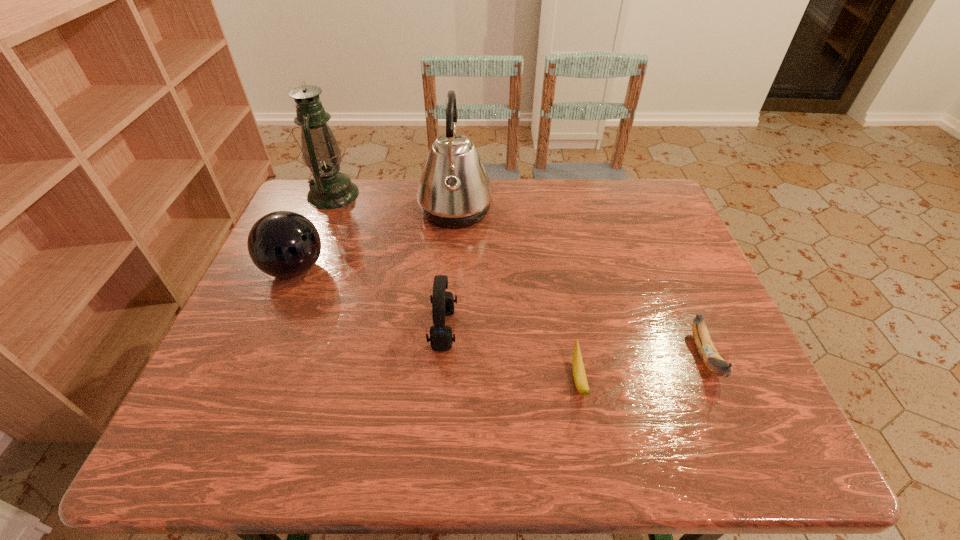
Where is `free spot between the right banana and the left banana`? free spot between the right banana and the left banana is located at coordinates (642, 368).

Where is `vacant region between the shorter banana and the fifth tallest object`? The height and width of the screenshot is (540, 960). vacant region between the shorter banana and the fifth tallest object is located at coordinates (642, 368).

Locate an element on the screen. The height and width of the screenshot is (540, 960). empty location between the bowling ball and the headset is located at coordinates (370, 299).

Locate an element on the screen. blank region between the headset and the shorter banana is located at coordinates (511, 355).

Image resolution: width=960 pixels, height=540 pixels. Identify the location of free space between the kettle and the fourth tallest object. (449, 271).

This screenshot has width=960, height=540. Find the location of `free spot between the headset and the kettle`. free spot between the headset and the kettle is located at coordinates (449, 271).

What are the coordinates of `the closest object to the taller banana` in the screenshot? It's located at (579, 374).

This screenshot has height=540, width=960. What are the coordinates of `the fourth closest object to the kettle` in the screenshot? It's located at 579,374.